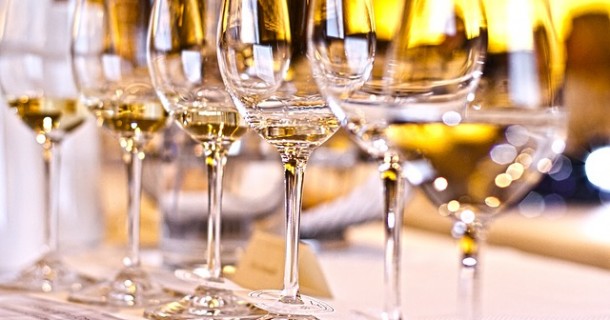
The image size is (610, 320). What are the coordinates of `wine stems` in the screenshot? It's located at (44, 191), (130, 223), (218, 227), (292, 238), (393, 247), (470, 278).